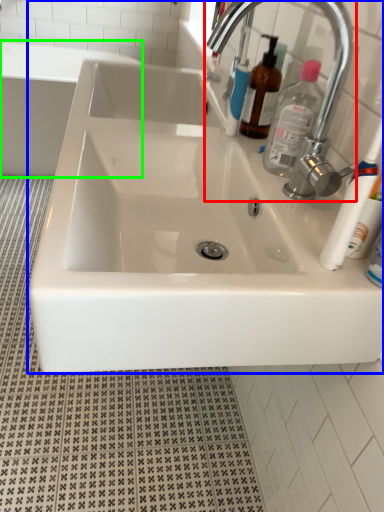
Question: Which object is the closest to the tap (highlighted by a red box)? Choose among these: sink (highlighted by a blue box) or bath (highlighted by a green box).

Choices:
 (A) sink
 (B) bath

Answer: (A)